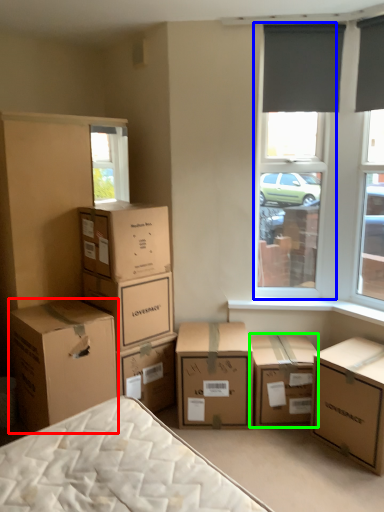
Question: Which object is the farthest from box (highlighted by a red box)? Choose among these: window screen (highlighted by a blue box) or box (highlighted by a green box).

Choices:
 (A) window screen
 (B) box

Answer: (A)